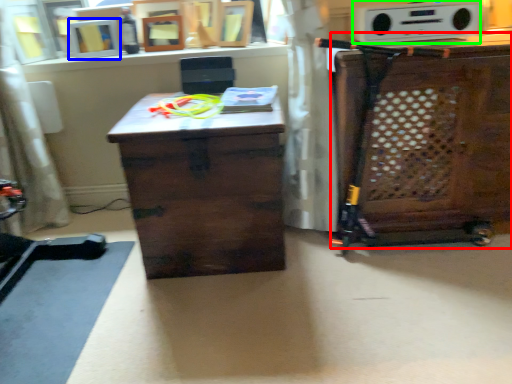
Question: Which object is the closest to the cabinetry (highlighted by a red box)? Choose among these: picture frame (highlighted by a blue box) or stereo (highlighted by a green box).

Choices:
 (A) picture frame
 (B) stereo

Answer: (B)